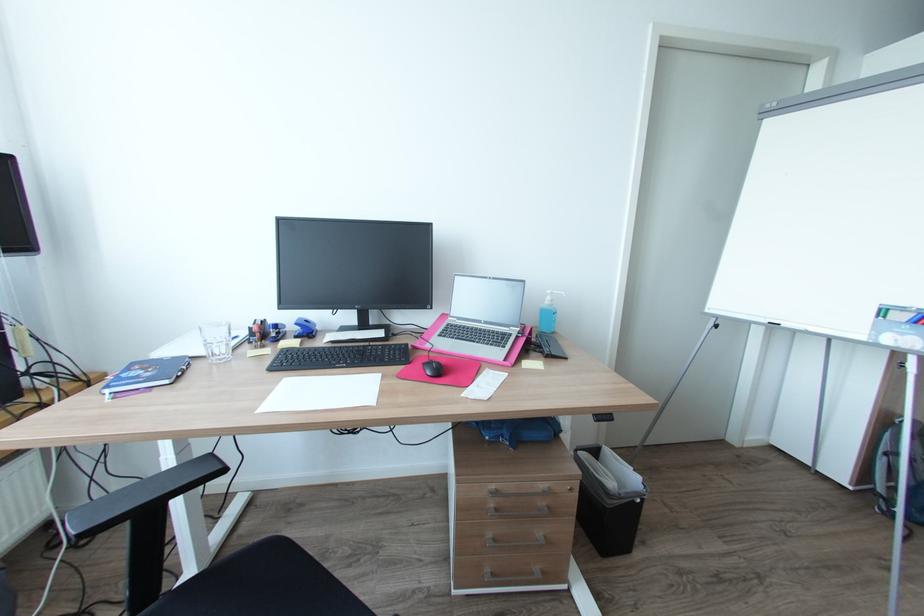
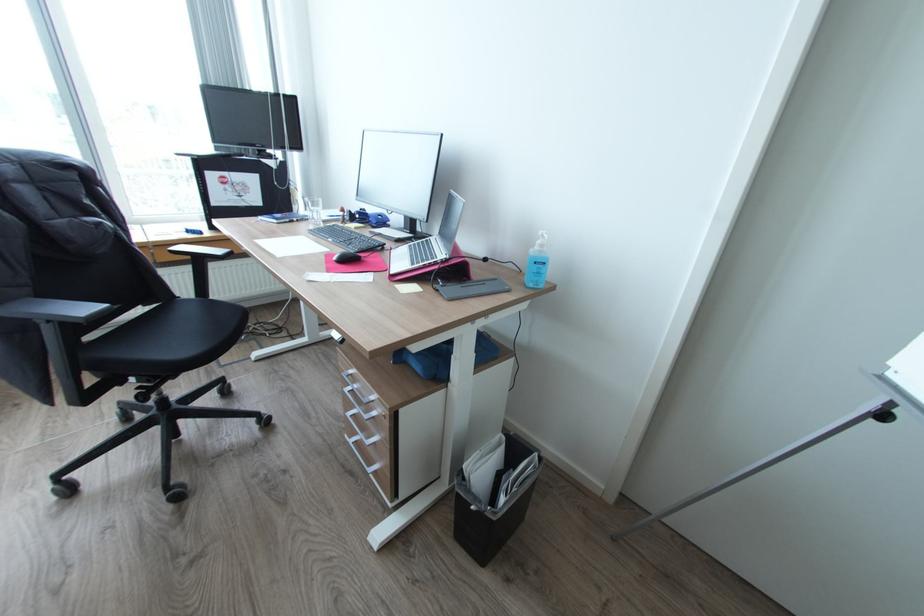
Where in the second image is the point corresponding to (497,487) from the first image?

(357, 371)